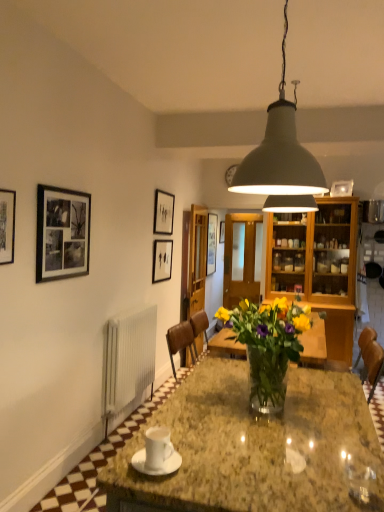
Measure the distance between point (160, 218) and camera.

Point (160, 218) is 14.63 feet away from camera.

The height and width of the screenshot is (512, 384). In order to click on matte black picture frame at upper center, positioned as the third picture frame in back-to-front order in this screenshot , I will do `click(163, 212)`.

Identify the location of white glossy coffee cup at center. (157, 447).

How much space does matte black picture frame at center, positioned as the third picture frame in right-to-left order, occupy vertically?

44.84 centimeters.

Identify the location of matte black picture frame at center, positioned as the second picture frame in back-to-front order. (162, 260).

What is the approximate height of yellow matte vase at center?

It is 4.11 inches.

This screenshot has height=512, width=384. I want to click on black matte picture frame at upper left, positioned as the fourth picture frame in right-to-left order, so click(x=62, y=233).

Considering the relative positions of matte white picture frame at upper center, arranged as the fourth picture frame when viewed from the left, and white glossy saucer at center in the image provided, is matte white picture frame at upper center, arranged as the fourth picture frame when viewed from the left, to the right of white glossy saucer at center from the viewer's perspective?

Indeed, matte white picture frame at upper center, arranged as the fourth picture frame when viewed from the left, is positioned on the right side of white glossy saucer at center.

What's the angular difference between matte white picture frame at upper center, which is the 1th picture frame from right to left, and white glossy saucer at center's facing directions?

The angle between the facing direction of matte white picture frame at upper center, which is the 1th picture frame from right to left, and the facing direction of white glossy saucer at center is 115 degrees.

From a real-world perspective, which is physically above, matte white picture frame at upper center, marked as the 4th picture frame in a front-to-back arrangement, or white glossy saucer at center?

From a 3D spatial view, matte white picture frame at upper center, marked as the 4th picture frame in a front-to-back arrangement, is above.

Which of these two, matte white picture frame at upper center, marked as the 4th picture frame in a front-to-back arrangement, or white glossy saucer at center, stands shorter?

white glossy saucer at center is shorter.

Which is less distant, (x=277, y=400) or (x=150, y=452)?

Point (x=277, y=400) appears to be farther away from the viewer than point (x=150, y=452).

Is clear glass vase at center facing away from white glossy coffee cup at center?

No, clear glass vase at center is not facing away from white glossy coffee cup at center.

From a real-world perspective, who is located higher, clear glass vase at center or white glossy coffee cup at center?

clear glass vase at center is physically above.

Considering the relative sizes of clear glass vase at center and white glossy coffee cup at center in the image provided, is clear glass vase at center thinner than white glossy coffee cup at center?

No, clear glass vase at center is not thinner than white glossy coffee cup at center.

Can you see matte black picture frame at upper center, arranged as the 2th picture frame when viewed from the front, touching matte white picture frame at upper center, which is the 1th picture frame from right to left?

No, matte black picture frame at upper center, arranged as the 2th picture frame when viewed from the front, is not making contact with matte white picture frame at upper center, which is the 1th picture frame from right to left.

From the image's perspective, which picture frame is the 1st one below the matte white picture frame at upper center, marked as the 4th picture frame in a front-to-back arrangement? Please provide its 2D coordinates.

[(163, 212)]

Considering their positions, is matte black picture frame at upper center, the 2th picture frame in the right-to-left sequence, located in front of or behind matte white picture frame at upper center, which is the first picture frame from back to front?

Clearly, matte black picture frame at upper center, the 2th picture frame in the right-to-left sequence, is in front of matte white picture frame at upper center, which is the first picture frame from back to front.

Is matte black picture frame at upper center, arranged as the third picture frame when viewed from the left, to the left of matte white picture frame at upper center, which is the first picture frame from back to front, from the viewer's perspective?

Yes, matte black picture frame at upper center, arranged as the third picture frame when viewed from the left, is to the left of matte white picture frame at upper center, which is the first picture frame from back to front.

How different are the orientations of matte black picture frame at center, positioned as the third picture frame in front-to-back order, and white glossy coffee cup at center in degrees?

1.31 degrees separate the facing orientations of matte black picture frame at center, positioned as the third picture frame in front-to-back order, and white glossy coffee cup at center.

From their relative heights in the image, would you say matte black picture frame at center, positioned as the third picture frame in front-to-back order, is taller or shorter than white glossy coffee cup at center?

matte black picture frame at center, positioned as the third picture frame in front-to-back order, is taller than white glossy coffee cup at center.

Is matte black picture frame at center, positioned as the second picture frame in back-to-front order, next to white glossy coffee cup at center?

matte black picture frame at center, positioned as the second picture frame in back-to-front order, is not next to white glossy coffee cup at center, and they're not touching.

Does matte black picture frame at center, the 2th picture frame from the left, have a lesser width compared to white glossy coffee cup at center?

Indeed, matte black picture frame at center, the 2th picture frame from the left, has a lesser width compared to white glossy coffee cup at center.

Choose the correct answer: Is clear glass vase at center inside yellow matte vase at center or outside it?

clear glass vase at center is located beyond the bounds of yellow matte vase at center.

Can you confirm if clear glass vase at center is positioned to the left of yellow matte vase at center?

Yes.

In terms of width, does clear glass vase at center look wider or thinner when compared to yellow matte vase at center?

clear glass vase at center is wider than yellow matte vase at center.

Is matte black picture frame at upper center, arranged as the 2th picture frame when viewed from the front, taller or shorter than yellow matte vase at center?

Clearly, matte black picture frame at upper center, arranged as the 2th picture frame when viewed from the front, is taller compared to yellow matte vase at center.

Which is behind, matte black picture frame at upper center, positioned as the third picture frame in back-to-front order, or yellow matte vase at center?

matte black picture frame at upper center, positioned as the third picture frame in back-to-front order, is further from the camera.

From the image's perspective, would you say matte black picture frame at upper center, the 2th picture frame in the right-to-left sequence, is shown under yellow matte vase at center?

No.

From a real-world perspective, which object stands above the other?

In real-world perspective, matte black picture frame at upper center, arranged as the third picture frame when viewed from the left, is above.

Is matte gray lampshade at upper center completely or partially outside of white glossy saucer at center?

Indeed, matte gray lampshade at upper center is completely outside white glossy saucer at center.

How many degrees apart are the facing directions of matte gray lampshade at upper center and white glossy saucer at center?

There is a 88.2-degree angle between the facing directions of matte gray lampshade at upper center and white glossy saucer at center.

Does matte gray lampshade at upper center have a lesser height compared to white glossy saucer at center?

In fact, matte gray lampshade at upper center may be taller than white glossy saucer at center.

Who is smaller, matte gray lampshade at upper center or white glossy saucer at center?

Smaller between the two is white glossy saucer at center.

Find the location of `saucer in front of the matte white picture frame at upper center, which is the 1th picture frame from right to left`. saucer in front of the matte white picture frame at upper center, which is the 1th picture frame from right to left is located at coordinates (158, 468).

In order to click on houseplant located above the white glossy coffee cup at center (from a real-world perspective) in this screenshot , I will do `click(267, 347)`.

Based on their spatial positions, is matte gray lampshade at upper center or matte black picture frame at upper center, arranged as the 2th picture frame when viewed from the front, closer to matte black picture frame at center, positioned as the third picture frame in right-to-left order?

matte black picture frame at upper center, arranged as the 2th picture frame when viewed from the front.

Based on their spatial positions, is matte black picture frame at upper center, positioned as the third picture frame in back-to-front order, or clear glass vase at center further from black matte picture frame at upper left, which is counted as the 1th picture frame, starting from the front?

matte black picture frame at upper center, positioned as the third picture frame in back-to-front order, lies further to black matte picture frame at upper left, which is counted as the 1th picture frame, starting from the front, than the other object.

Looking at the image, which one is located further to white glossy coffee cup at center, matte black picture frame at upper center, the 2th picture frame in the right-to-left sequence, or yellow matte vase at center?

matte black picture frame at upper center, the 2th picture frame in the right-to-left sequence, lies further to white glossy coffee cup at center than the other object.

From the image, which object appears to be nearer to white glossy coffee cup at center, matte black picture frame at upper center, the 2th picture frame in the right-to-left sequence, or black matte picture frame at upper left, which is counted as the 1th picture frame, starting from the front?

black matte picture frame at upper left, which is counted as the 1th picture frame, starting from the front, lies closer to white glossy coffee cup at center than the other object.

Based on their spatial positions, is yellow matte vase at center or matte gray lampshade at upper center closer to matte black picture frame at upper center, the 2th picture frame in the right-to-left sequence?

The object closer to matte black picture frame at upper center, the 2th picture frame in the right-to-left sequence, is matte gray lampshade at upper center.

Looking at the image, which one is located further to white glossy coffee cup at center, clear glass vase at center or matte white picture frame at upper center, which is the first picture frame from back to front?

matte white picture frame at upper center, which is the first picture frame from back to front, is further to white glossy coffee cup at center.

Looking at the image, which one is located further to yellow matte vase at center, clear glass vase at center or matte white picture frame at upper center, arranged as the fourth picture frame when viewed from the left?

The object further to yellow matte vase at center is matte white picture frame at upper center, arranged as the fourth picture frame when viewed from the left.

Which object lies further to the anchor point matte black picture frame at center, positioned as the second picture frame in back-to-front order, white glossy saucer at center or matte white picture frame at upper center, which is the 1th picture frame from right to left?

white glossy saucer at center lies further to matte black picture frame at center, positioned as the second picture frame in back-to-front order, than the other object.

Locate an element on the screen. flower between white glossy saucer at center and matte black picture frame at upper center, arranged as the third picture frame when viewed from the left, from front to back is located at coordinates (281, 305).

Where is `lamp positioned between white glossy saucer at center and matte black picture frame at center, positioned as the third picture frame in front-to-back order, from near to far`? Image resolution: width=384 pixels, height=512 pixels. lamp positioned between white glossy saucer at center and matte black picture frame at center, positioned as the third picture frame in front-to-back order, from near to far is located at coordinates (281, 157).

Find the location of a particular element. lamp between white glossy coffee cup at center and yellow matte vase at center in the front-back direction is located at coordinates (281, 157).

Where is `picture frame between matte black picture frame at center, positioned as the third picture frame in front-to-back order, and yellow matte vase at center, in the horizontal direction`? Image resolution: width=384 pixels, height=512 pixels. picture frame between matte black picture frame at center, positioned as the third picture frame in front-to-back order, and yellow matte vase at center, in the horizontal direction is located at coordinates (163, 212).